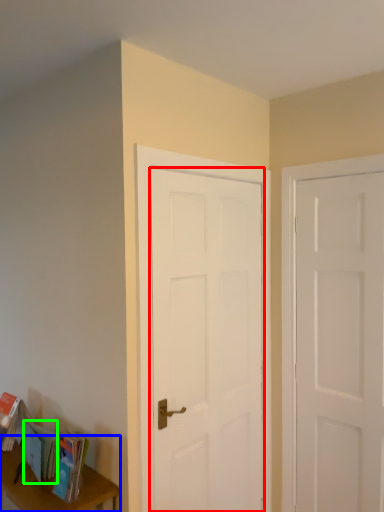
Question: Which object is the farthest from door (highlighted by a red box)? Choose among these: table (highlighted by a blue box) or book (highlighted by a green box).

Choices:
 (A) table
 (B) book

Answer: (B)